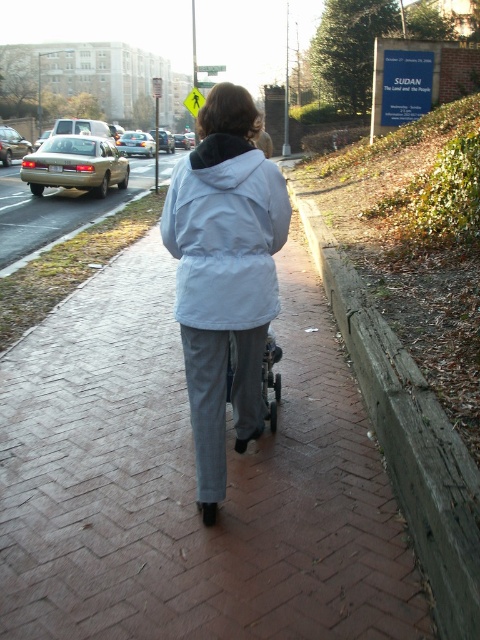
Question: Estimate the real-world distances between objects in this image. Which object is closer to the wooden at right?

Choices:
 (A) brick pavement at center
 (B) white matte jacket at center
 (C) metallic silver baby carriage at center

Answer: (C)

Question: Does brick pavement at center appear on the right side of light blue fabric at center?

Choices:
 (A) yes
 (B) no

Answer: (B)

Question: Does brick pavement at center appear over wooden at right?

Choices:
 (A) yes
 (B) no

Answer: (A)

Question: Which point is farther from the camera taking this photo?

Choices:
 (A) (200, 321)
 (B) (252, 186)

Answer: (A)

Question: Does light blue fabric at center appear on the right side of white matte jacket at center?

Choices:
 (A) no
 (B) yes

Answer: (B)

Question: Which point is farther from the camera taking this photo?

Choices:
 (A) (15, 488)
 (B) (202, 508)
 (C) (253, 156)
 (D) (262, 360)

Answer: (A)